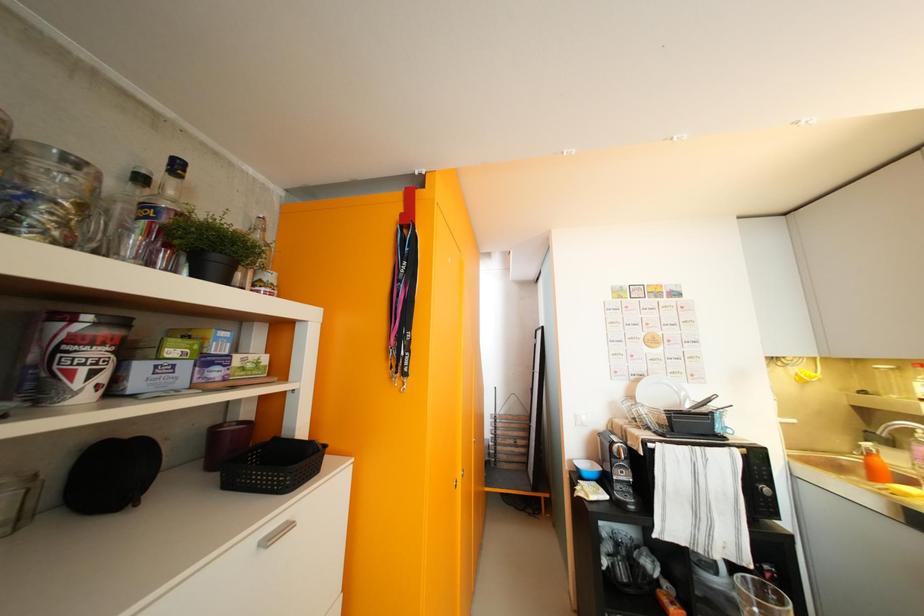
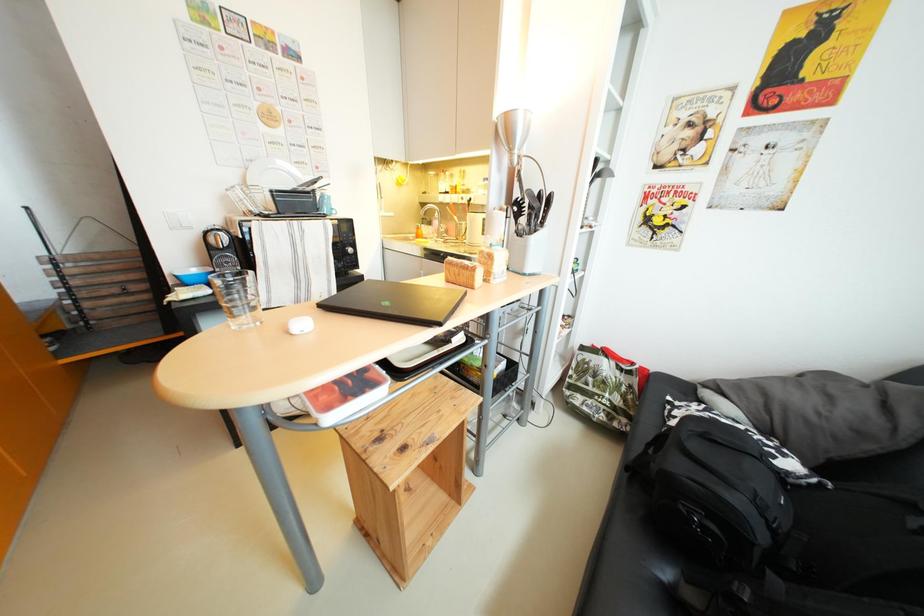
How did the camera likely rotate?

The camera rotated toward right-down.